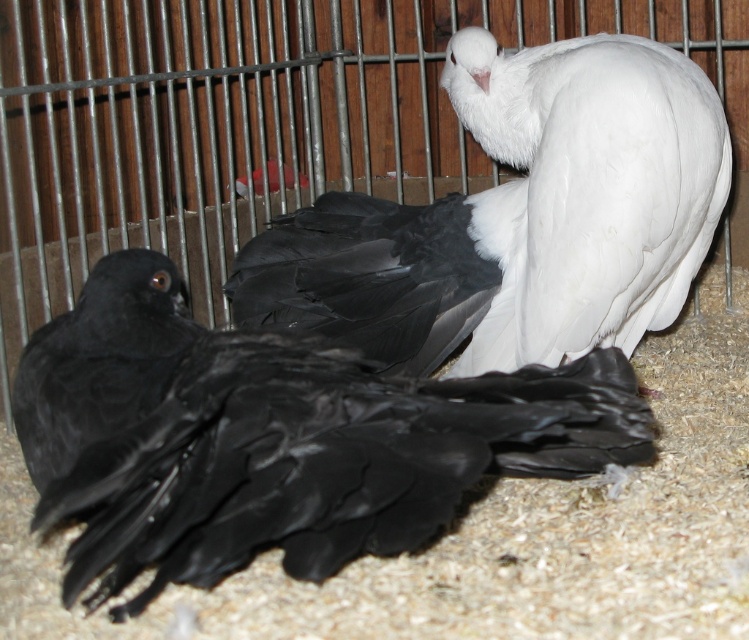
Can you confirm if black glossy feathers at center is bigger than white feathered bird at upper right?

Incorrect, black glossy feathers at center is not larger than white feathered bird at upper right.

You are a GUI agent. You are given a task and a screenshot of the screen. Output one action in this format:
    pyautogui.click(x=<x>, y=<y>)
    Task: Click on the black glossy feathers at center
    The width and height of the screenshot is (749, 640).
    Given the screenshot: What is the action you would take?
    pyautogui.click(x=273, y=438)

I want to click on black glossy feathers at center, so click(273, 438).